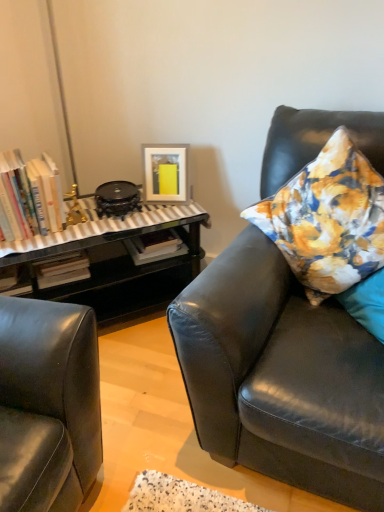
Locate an element on the screen. floral fabric pillow at right is located at coordinates (328, 219).

The width and height of the screenshot is (384, 512). What do you see at coordinates (30, 196) in the screenshot?
I see `hardcover books at left` at bounding box center [30, 196].

What is the approximate height of matte black leather couch at right?

The height of matte black leather couch at right is 37.33 inches.

What do you see at coordinates (165, 173) in the screenshot? The image size is (384, 512). I see `matte white picture frame at upper center` at bounding box center [165, 173].

You are a GUI agent. You are given a task and a screenshot of the screen. Output one action in this format:
    pyautogui.click(x=<x>, y=<y>)
    Task: Click on the floral fabric pillow at right
    
    Given the screenshot: What is the action you would take?
    pyautogui.click(x=328, y=219)

Is hardcover books at left thinner than matte black leather couch at right?

Yes.

From the image's perspective, is hardcover books at left above or below matte black leather couch at right?

hardcover books at left is situated higher than matte black leather couch at right in the image.

Between matte black leather couch at right and hardcover books at left, which one has more height?

matte black leather couch at right is taller.

Is there a large distance between matte black leather couch at right and hardcover books at left?

No, matte black leather couch at right is not far from hardcover books at left.

Is matte black leather couch at right facing towards hardcover books at left?

No, matte black leather couch at right is not aimed at hardcover books at left.

Which of these two, matte black leather couch at right or hardcover books at left, is smaller?

hardcover books at left is smaller.

Considering the relative sizes of floral fabric pillow at right and matte black leather couch at right in the image provided, is floral fabric pillow at right smaller than matte black leather couch at right?

Yes.

Does point (295, 238) come in front of point (193, 395)?

No, it is behind (193, 395).

Is floral fabric pillow at right taller than matte black leather couch at right?

No.

Considering the sizes of objects hardcover books at left and floral fabric pillow at right in the image provided, who is shorter, hardcover books at left or floral fabric pillow at right?

With less height is hardcover books at left.

From a real-world perspective, is hardcover books at left above or below floral fabric pillow at right?

hardcover books at left is situated lower than floral fabric pillow at right in the real world.

Considering the relative positions of hardcover books at left and floral fabric pillow at right in the image provided, is hardcover books at left to the right of floral fabric pillow at right from the viewer's perspective?

No.

Looking at this image, is floral fabric pillow at right at the left side of matte white picture frame at upper center?

Incorrect, floral fabric pillow at right is not on the left side of matte white picture frame at upper center.

From a real-world perspective, which object rests below the other?

From a 3D spatial view, matte white picture frame at upper center is below.

Is floral fabric pillow at right touching matte white picture frame at upper center?

floral fabric pillow at right is not next to matte white picture frame at upper center, and they're not touching.

Is matte white picture frame at upper center inside or outside of hardcover books at left?

matte white picture frame at upper center cannot be found inside hardcover books at left.

Is matte white picture frame at upper center at the left side of hardcover books at left?

No, matte white picture frame at upper center is not to the left of hardcover books at left.

From the image's perspective, is matte white picture frame at upper center above hardcover books at left?

Yes, from the image's perspective, matte white picture frame at upper center is on top of hardcover books at left.

Is matte white picture frame at upper center further to camera compared to hardcover books at left?

That is True.

Does matte white picture frame at upper center appear on the left side of matte black leather couch at right?

Indeed, matte white picture frame at upper center is positioned on the left side of matte black leather couch at right.

What's the angular difference between matte white picture frame at upper center and matte black leather couch at right's facing directions?

matte white picture frame at upper center and matte black leather couch at right are facing 17 degrees away from each other.

In the image, there is a matte black leather couch at right. At what (x,y) coordinates should I click in order to perform the action: click on picture frame above it (from the image's perspective). Please return your answer as a coordinate pair (x, y). Looking at the image, I should click on (x=165, y=173).

From a real-world perspective, is matte white picture frame at upper center positioned above or below matte black leather couch at right?

From a real-world perspective, matte white picture frame at upper center is physically above matte black leather couch at right.

I want to click on studio couch in front of the hardcover books at left, so click(281, 376).

This screenshot has width=384, height=512. Identify the location of studio couch directly beneath the hardcover books at left (from a real-world perspective). tap(281, 376).

When comparing their distances from matte white picture frame at upper center, does matte black leather couch at right or hardcover books at left seem closer?

Based on the image, hardcover books at left appears to be nearer to matte white picture frame at upper center.

Considering their positions, is matte white picture frame at upper center positioned further to matte black leather couch at right than floral fabric pillow at right?

matte white picture frame at upper center is positioned further to the anchor matte black leather couch at right.

From the image, which object appears to be farther from hardcover books at left, matte white picture frame at upper center or floral fabric pillow at right?

floral fabric pillow at right.

Based on their spatial positions, is hardcover books at left or matte black leather couch at right closer to floral fabric pillow at right?

The object closer to floral fabric pillow at right is matte black leather couch at right.

Considering their positions, is floral fabric pillow at right positioned further to matte white picture frame at upper center than matte black leather couch at right?

→ matte black leather couch at right is further to matte white picture frame at upper center.

Consider the image. From the image, which object appears to be nearer to matte white picture frame at upper center, hardcover books at left or matte black leather couch at right?

hardcover books at left is positioned closer to the anchor matte white picture frame at upper center.

Looking at this image, looking at the image, which one is located closer to floral fabric pillow at right, matte black leather couch at right or matte white picture frame at upper center?

matte black leather couch at right is positioned closer to the anchor floral fabric pillow at right.

Considering their positions, is matte white picture frame at upper center positioned closer to floral fabric pillow at right than matte black leather couch at right?

matte black leather couch at right.

Find the location of a particular element. Image resolution: width=384 pixels, height=512 pixels. pillow between matte black leather couch at right and matte white picture frame at upper center from front to back is located at coordinates (328, 219).

The height and width of the screenshot is (512, 384). What are the coordinates of `book between matte black leather couch at right and matte white picture frame at upper center from front to back` in the screenshot? It's located at (30, 196).

Find the location of a particular element. picture frame between hardcover books at left and floral fabric pillow at right in the horizontal direction is located at coordinates (165, 173).

The image size is (384, 512). What are the coordinates of `studio couch located between hardcover books at left and floral fabric pillow at right in the left-right direction` in the screenshot? It's located at (281, 376).